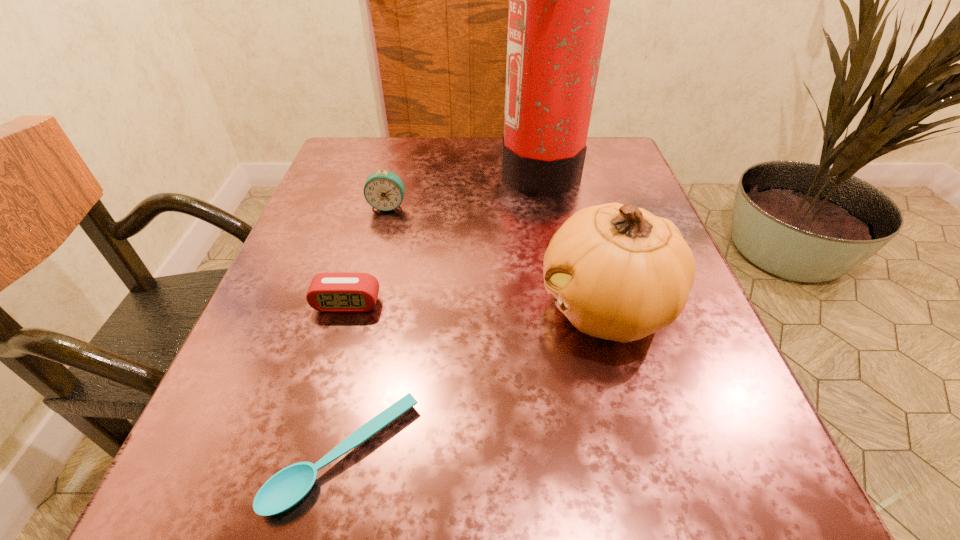
What are the coordinates of `vacant region that satisfies the following two spatial constraints: 1. on the front-facing side of the shortest object; 2. on the right side of the third tallest object` in the screenshot? It's located at (324, 455).

At what (x,y) coordinates should I click in order to perform the action: click on free region that satisfies the following two spatial constraints: 1. on the front side of the fire extinguisher; 2. on the front-facing side of the shorter alarm clock. Please return your answer as a coordinate pair (x, y). Looking at the image, I should click on (564, 304).

Where is `free spot that satisfies the following two spatial constraints: 1. on the front side of the fire extinguisher; 2. on the front-facing side of the nearer alarm clock`? Image resolution: width=960 pixels, height=540 pixels. free spot that satisfies the following two spatial constraints: 1. on the front side of the fire extinguisher; 2. on the front-facing side of the nearer alarm clock is located at coordinates (564, 304).

You are a GUI agent. You are given a task and a screenshot of the screen. Output one action in this format:
    pyautogui.click(x=<x>, y=<y>)
    Task: Click on the vacant position in the image that satisfies the following two spatial constraints: 1. on the front side of the fire extinguisher; 2. on the front-facing side of the third shortest object
    
    Given the screenshot: What is the action you would take?
    pyautogui.click(x=546, y=206)